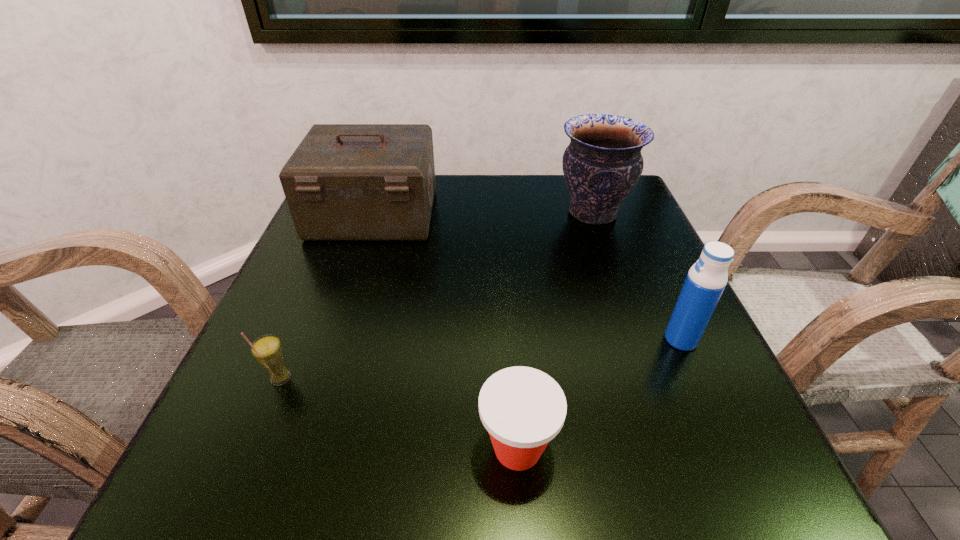
The width and height of the screenshot is (960, 540). Identify the location of vacant region located 0.160m on the back of the third farthest object. (649, 268).

Where is `free region located 0.150m on the front of the second nearest object`? free region located 0.150m on the front of the second nearest object is located at coordinates (234, 490).

I want to click on vacant space located 0.200m on the back of the Dixie cup, so click(509, 314).

Where is `pottery positioned at the far edge`? pottery positioned at the far edge is located at coordinates (602, 164).

At what (x,y) coordinates should I click in order to perform the action: click on the first-aid kit that is at the far edge. Please return your answer as a coordinate pair (x, y). This screenshot has height=540, width=960. Looking at the image, I should click on pos(344,182).

Locate an element on the screen. The image size is (960, 540). object present at the near edge is located at coordinates (522, 408).

Identify the location of the first-aid kit that is at the left edge. This screenshot has height=540, width=960. [344, 182].

Locate an element on the screen. This screenshot has width=960, height=540. straw for drinking that is at the left edge is located at coordinates (267, 350).

Identify the location of pottery located at the right edge. (602, 164).

I want to click on water bottle that is at the right edge, so 706,280.